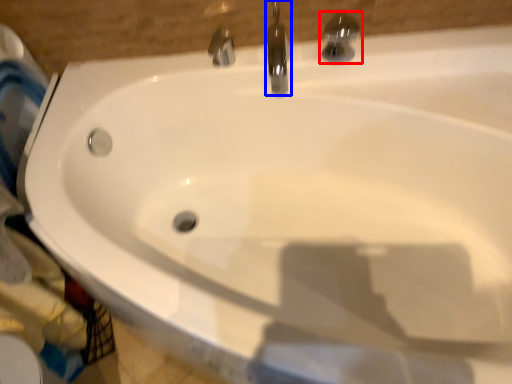
Question: Which object is closer to the camera taking this photo, tap (highlighted by a red box) or tap (highlighted by a blue box)?

Choices:
 (A) tap
 (B) tap

Answer: (A)